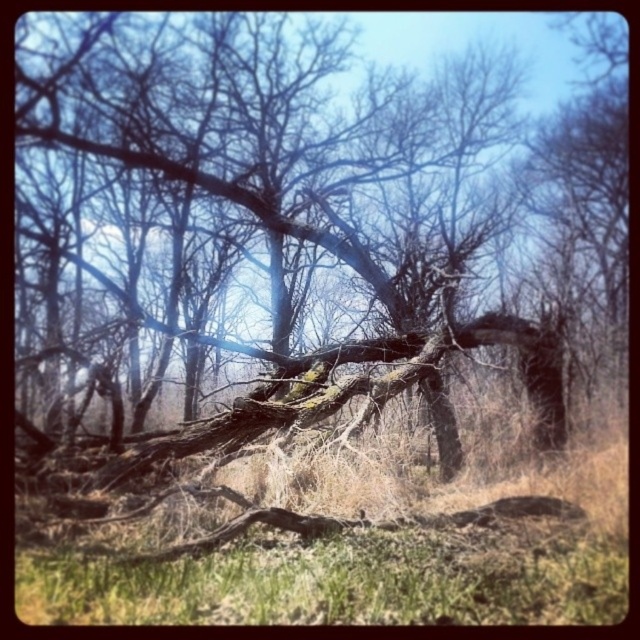
Question: Which point is farther to the camera?

Choices:
 (A) (525, 308)
 (B) (609, 576)

Answer: (A)

Question: Is brown textured log at center to the left of green grass at center from the viewer's perspective?

Choices:
 (A) yes
 (B) no

Answer: (A)

Question: Does brown textured log at center appear over green grass at center?

Choices:
 (A) yes
 (B) no

Answer: (A)

Question: Which object is farther from the camera taking this photo?

Choices:
 (A) brown textured log at center
 (B) green grass at center

Answer: (A)

Question: Is brown textured log at center below green grass at center?

Choices:
 (A) no
 (B) yes

Answer: (A)

Question: Which point is closer to the camera?

Choices:
 (A) green grass at center
 (B) brown textured log at center

Answer: (A)